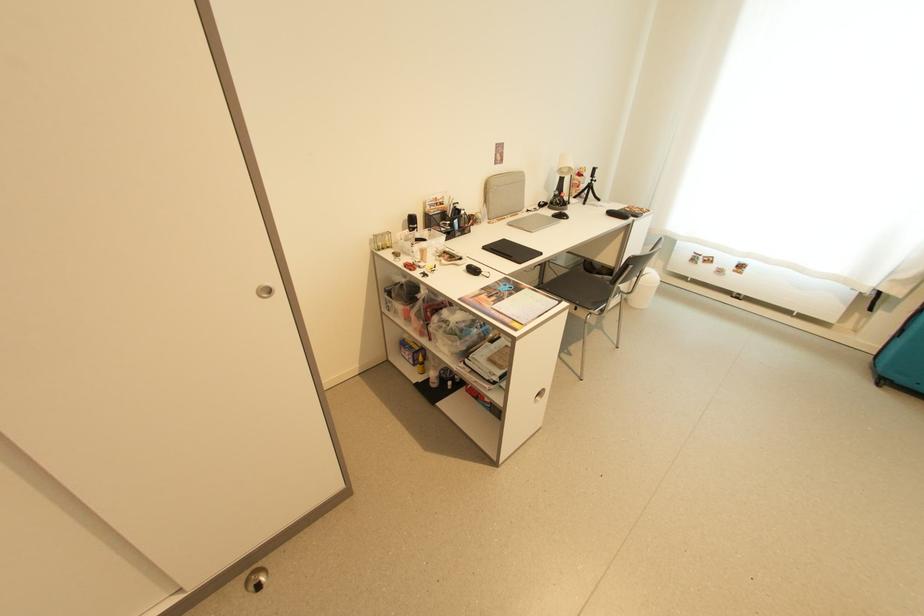
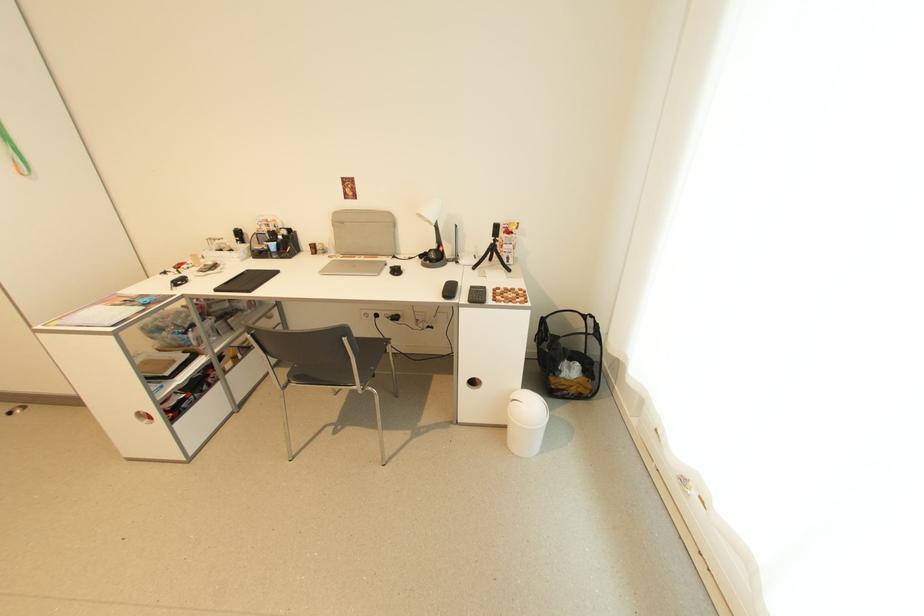
Where in the second image is the point corresponding to point (597, 179) from the first image?

(497, 238)